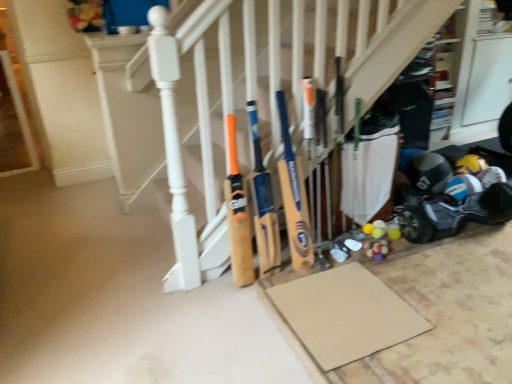
Locate an element on the screen. The image size is (512, 384). vacant region to the left of wooden bat at center, the 1th baseball bat from the left is located at coordinates (205, 293).